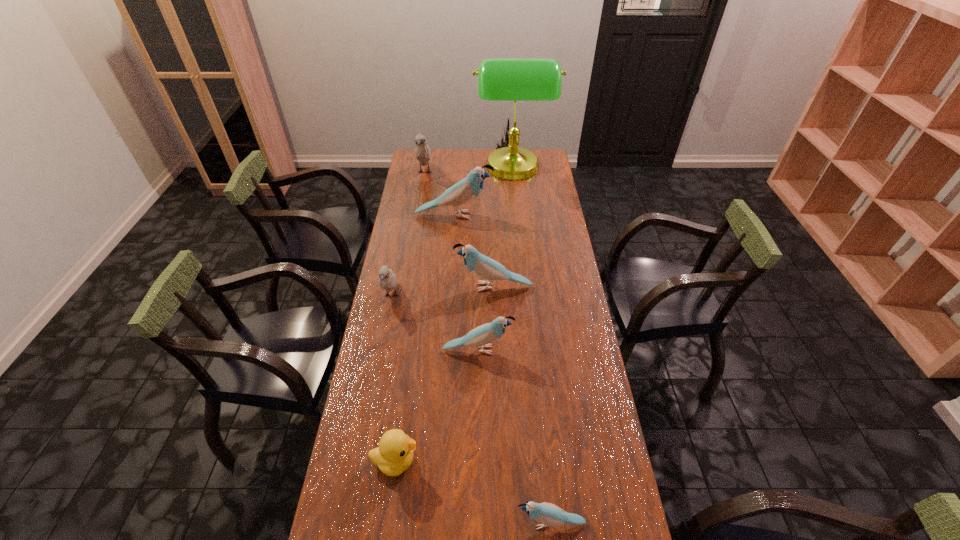
Identify the location of blue bird that is the closest to the yellow duck. (547, 514).

Find the location of a particular element. The width and height of the screenshot is (960, 540). blank area in the image that satisfies the following two spatial constraints: 1. at the face of the biggest blue bird; 2. at the beak of the nearer white bird is located at coordinates (448, 295).